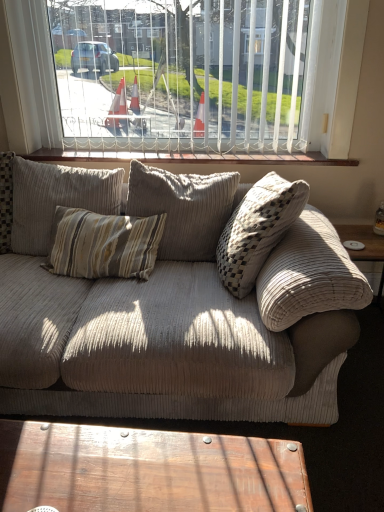
Identify the location of vacant space situated above wooden polished coffee table at lower center (from a real-world perspective). (122, 464).